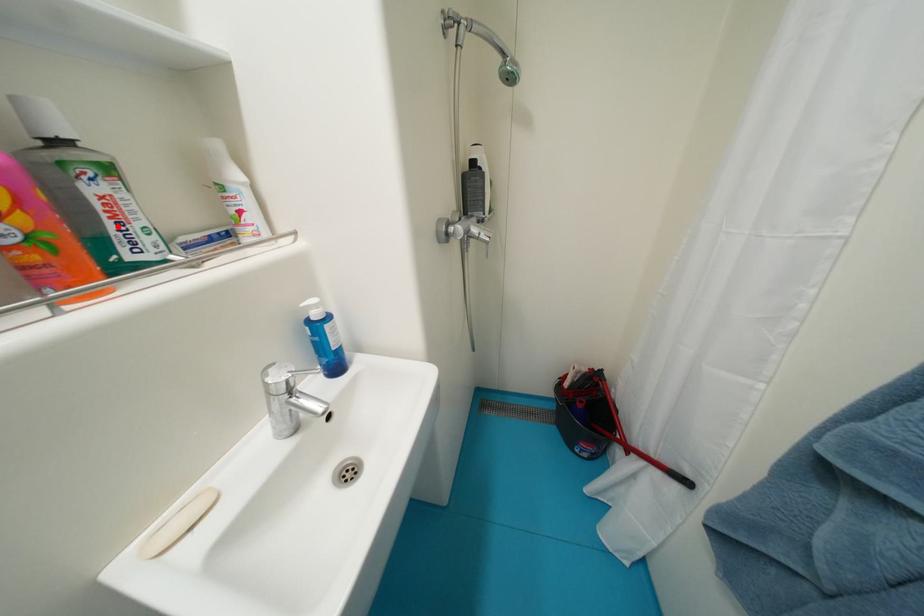
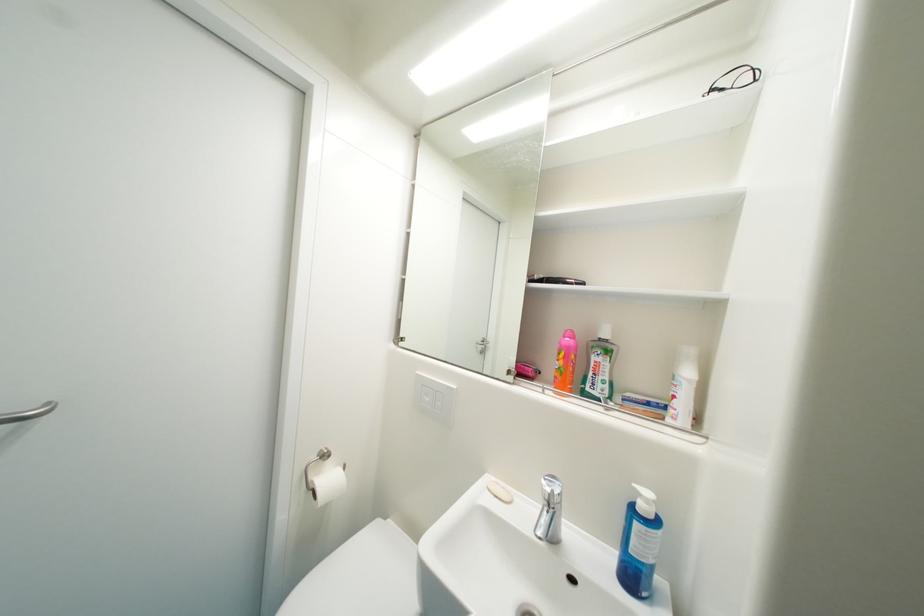
Where in the second image is the point corresponding to the highlighted location from the first image?

(598, 376)